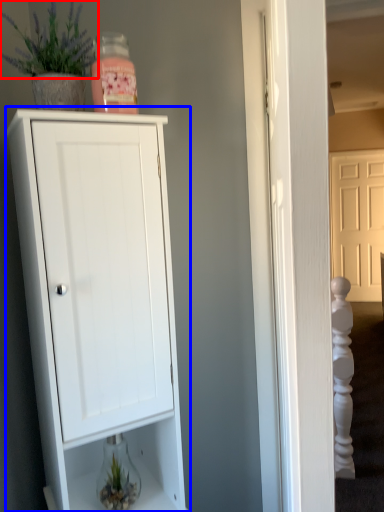
Question: Which point is closer to the camera, plant (highlighted by a red box) or cupboard (highlighted by a blue box)?

Choices:
 (A) plant
 (B) cupboard

Answer: (B)